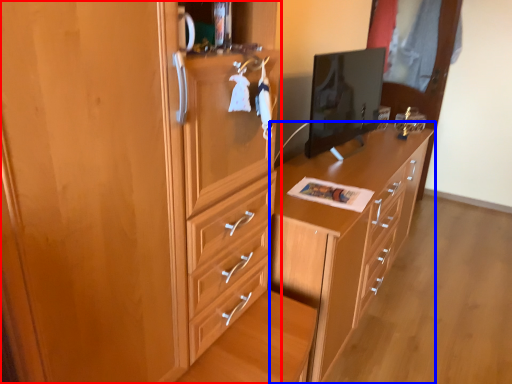
Question: Which object is closer to the camera taking this photo, cabinetry (highlighted by a red box) or chest of drawers (highlighted by a blue box)?

Choices:
 (A) cabinetry
 (B) chest of drawers

Answer: (A)